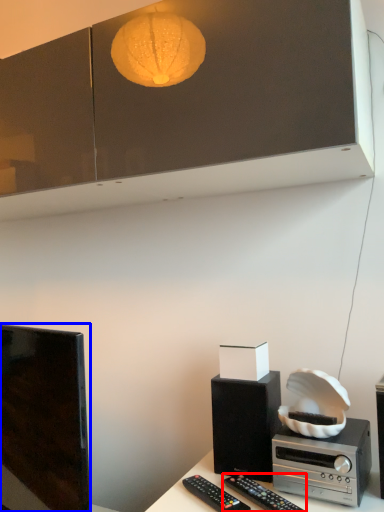
Question: Among these objects, which one is farthest to the camera, remote control (highlighted by a red box) or television (highlighted by a blue box)?

Choices:
 (A) remote control
 (B) television

Answer: (B)